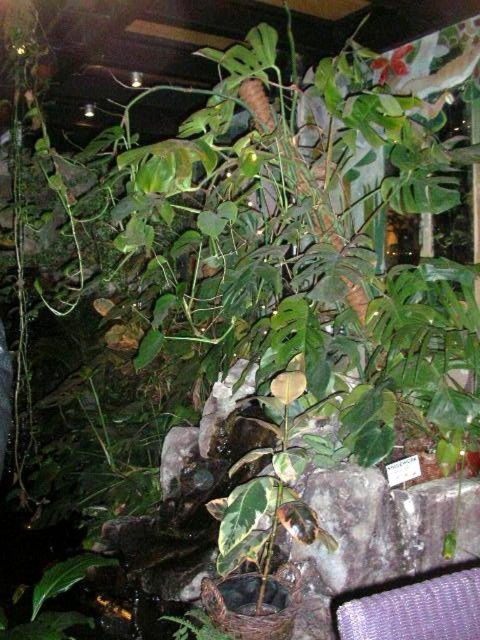
Does purple woven chair at lower right have a greater height compared to green glossy leaf at center?

No.

Is purple woven chair at lower right below green glossy leaf at center?

→ No.

Which is in front, point (405, 621) or point (212, 627)?

Positioned in front is point (405, 621).

This screenshot has width=480, height=640. In order to click on purple woven chair at lower right in this screenshot , I will do `click(417, 609)`.